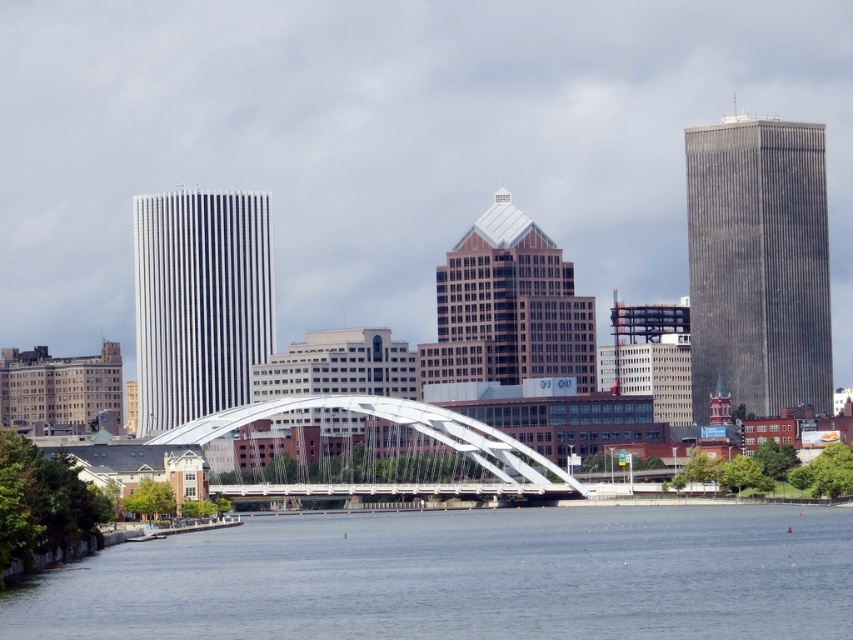
You are a delivery drone flying at an altitude of 30 meters. You need to land on the white metallic bridge at center. Is the brown glass skyscraper at center close enough to interfere with your landing?

The brown glass skyscraper at center is 28.08 meters away from the white metallic bridge at center. Since the drone is flying at 30 meters altitude, the skyscraper is slightly below the drone, so it might not interfere with the landing. However, the drone should still exercise caution to avoid any potential obstacles during descent.

You are standing on the white pedestrian bridge and want to walk to the gray concrete skyscraper at right and the brown glass skyscraper at center. Which building will you reach first?

You will reach the gray concrete skyscraper at right first because it is closer to you than the brown glass skyscraper at center, which is further away.